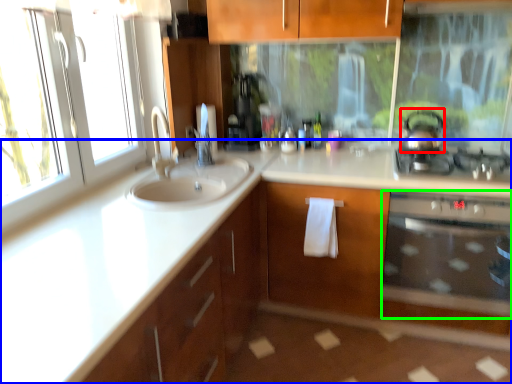
Question: Based on their relative distances, which object is farther from tea pot (highlighted by a red box)? Choose from countertop (highlighted by a blue box) and oven (highlighted by a green box).

Choices:
 (A) countertop
 (B) oven

Answer: (A)